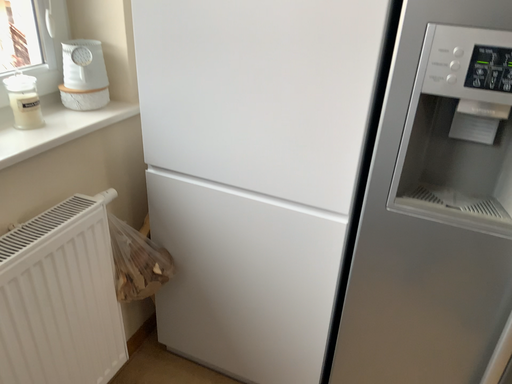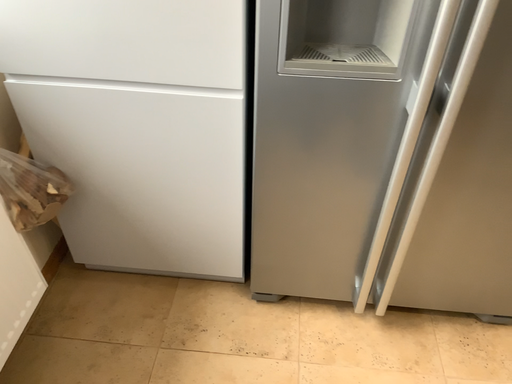
Question: How did the camera likely rotate when shooting the video?

Choices:
 (A) rotated downward
 (B) rotated upward

Answer: (A)